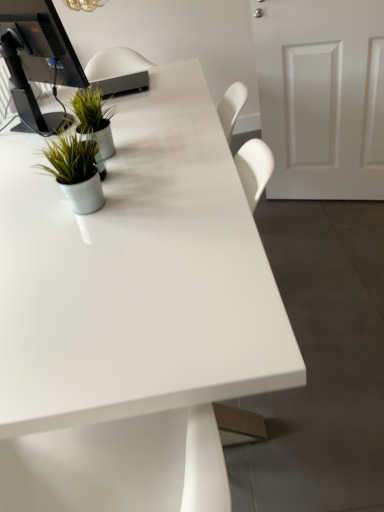
At what (x,y) coordinates should I click in order to perform the action: click on black glossy monitor at upper left. Please return your answer as a coordinate pair (x, y). This screenshot has width=384, height=512. Looking at the image, I should click on (36, 53).

What do you see at coordinates (76, 170) in the screenshot? I see `metallic silver pot at left, which is counted as the first houseplant, starting from the bottom` at bounding box center [76, 170].

Locate an element on the screen. Image resolution: width=384 pixels, height=512 pixels. white matte door at right is located at coordinates (322, 97).

Is point (31, 1) farther from viewer compared to point (53, 164)?

That is True.

Who is smaller, black glossy monitor at upper left or metallic silver pot at left, which is counted as the first houseplant, starting from the bottom?

metallic silver pot at left, which is counted as the first houseplant, starting from the bottom, is smaller.

Can you confirm if black glossy monitor at upper left is shorter than metallic silver pot at left, the 2th houseplant in the top-to-bottom sequence?

In fact, black glossy monitor at upper left may be taller than metallic silver pot at left, the 2th houseplant in the top-to-bottom sequence.

Can you confirm if white glossy desk at center is thinner than metallic silver pot at left, marked as the first houseplant in a front-to-back arrangement?

In fact, white glossy desk at center might be wider than metallic silver pot at left, marked as the first houseplant in a front-to-back arrangement.

Which is more to the right, white glossy desk at center or metallic silver pot at left, the 2th houseplant in the top-to-bottom sequence?

Positioned to the right is white glossy desk at center.

Is white glossy desk at center turned away from metallic silver pot at left, positioned as the 2th houseplant in back-to-front order?

That's not correct — white glossy desk at center is not looking away from metallic silver pot at left, positioned as the 2th houseplant in back-to-front order.

How far apart are white glossy desk at center and metallic silver pot at left, positioned as the 2th houseplant in back-to-front order?

white glossy desk at center is 13.49 inches away from metallic silver pot at left, positioned as the 2th houseplant in back-to-front order.

Is white glossy desk at center positioned beyond the bounds of green matte plant at upper left, which is the 1th houseplant in back-to-front order?

Absolutely, white glossy desk at center is external to green matte plant at upper left, which is the 1th houseplant in back-to-front order.

Would you say white glossy desk at center is a long distance from green matte plant at upper left, marked as the second houseplant in a front-to-back arrangement?

No.

Does white glossy desk at center come in front of green matte plant at upper left, arranged as the 1th houseplant when viewed from the top?

That is True.

From a real-world perspective, between white glossy desk at center and green matte plant at upper left, which is the 2th houseplant in bottom-to-top order, who is vertically higher?

green matte plant at upper left, which is the 2th houseplant in bottom-to-top order.

Can you tell me how much white matte door at right and metallic silver pot at left, which is counted as the first houseplant, starting from the bottom, differ in facing direction?

white matte door at right and metallic silver pot at left, which is counted as the first houseplant, starting from the bottom, are facing 111 degrees away from each other.

Does white matte door at right touch metallic silver pot at left, positioned as the 2th houseplant in back-to-front order?

No, white matte door at right is not touching metallic silver pot at left, positioned as the 2th houseplant in back-to-front order.

In terms of width, does white matte door at right look wider or thinner when compared to metallic silver pot at left, marked as the first houseplant in a front-to-back arrangement?

Considering their sizes, white matte door at right looks slimmer than metallic silver pot at left, marked as the first houseplant in a front-to-back arrangement.

From a real-world perspective, is white matte door at right over metallic silver pot at left, the 2th houseplant in the top-to-bottom sequence?

No, from a real-world perspective, white matte door at right is not above metallic silver pot at left, the 2th houseplant in the top-to-bottom sequence.

From the image's perspective, between green matte plant at upper left, which is the 1th houseplant in back-to-front order, and metallic silver pot at left, marked as the first houseplant in a front-to-back arrangement, which one is located above?

green matte plant at upper left, which is the 1th houseplant in back-to-front order, is shown above in the image.

Which object is further away from the camera, green matte plant at upper left, which is the 1th houseplant in back-to-front order, or metallic silver pot at left, marked as the first houseplant in a front-to-back arrangement?

green matte plant at upper left, which is the 1th houseplant in back-to-front order, is further from the camera.

From a real-world perspective, between green matte plant at upper left, marked as the second houseplant in a front-to-back arrangement, and metallic silver pot at left, positioned as the 2th houseplant in back-to-front order, who is vertically higher?

metallic silver pot at left, positioned as the 2th houseplant in back-to-front order, is physically above.

Which object is positioned more to the right, white glossy desk at center or white matte door at right?

Positioned to the right is white matte door at right.

Which is correct: white glossy desk at center is inside white matte door at right, or outside of it?

white glossy desk at center cannot be found inside white matte door at right.

Which of these two, white glossy desk at center or white matte door at right, stands taller?

With more height is white matte door at right.

Is point (54, 150) closer or farther from the camera than point (365, 71)?

Point (54, 150) is closer to the camera than point (365, 71).

Is metallic silver pot at left, positioned as the 2th houseplant in back-to-front order, far from white matte door at right?

metallic silver pot at left, positioned as the 2th houseplant in back-to-front order, is positioned a significant distance from white matte door at right.

From a real-world perspective, is metallic silver pot at left, the 2th houseplant in the top-to-bottom sequence, below white matte door at right?

Actually, metallic silver pot at left, the 2th houseplant in the top-to-bottom sequence, is physically above white matte door at right in the real world.

Is metallic silver pot at left, marked as the first houseplant in a front-to-back arrangement, inside the boundaries of white matte door at right, or outside?

metallic silver pot at left, marked as the first houseplant in a front-to-back arrangement, is spatially situated outside white matte door at right.

Where is `desktop computer lying above the metallic silver pot at left, positioned as the 2th houseplant in back-to-front order (from the image's perspective)`? This screenshot has width=384, height=512. desktop computer lying above the metallic silver pot at left, positioned as the 2th houseplant in back-to-front order (from the image's perspective) is located at coordinates (36, 53).

In the image, there is a metallic silver pot at left, which is counted as the first houseplant, starting from the bottom. Where is `desk below it (from the image's perspective)`? The height and width of the screenshot is (512, 384). desk below it (from the image's perspective) is located at coordinates (133, 314).

Considering their positions, is green matte plant at upper left, which is the 1th houseplant in back-to-front order, positioned closer to white matte door at right than metallic silver pot at left, marked as the first houseplant in a front-to-back arrangement?

The object closer to white matte door at right is green matte plant at upper left, which is the 1th houseplant in back-to-front order.

Which object lies further to the anchor point white matte door at right, metallic silver pot at left, positioned as the 2th houseplant in back-to-front order, or white glossy desk at center?

The object further to white matte door at right is metallic silver pot at left, positioned as the 2th houseplant in back-to-front order.

From the image, which object appears to be nearer to white matte door at right, white glossy desk at center or black glossy monitor at upper left?

Among the two, white glossy desk at center is located nearer to white matte door at right.

From the image, which object appears to be nearer to green matte plant at upper left, which is the 1th houseplant in back-to-front order, white glossy desk at center or black glossy monitor at upper left?

white glossy desk at center.

Which object lies nearer to the anchor point black glossy monitor at upper left, white glossy desk at center or metallic silver pot at left, marked as the first houseplant in a front-to-back arrangement?

white glossy desk at center lies closer to black glossy monitor at upper left than the other object.

Estimate the real-world distances between objects in this image. Which object is further from green matte plant at upper left, marked as the second houseplant in a front-to-back arrangement, white glossy desk at center or white matte door at right?

The object further to green matte plant at upper left, marked as the second houseplant in a front-to-back arrangement, is white matte door at right.

Looking at the image, which one is located closer to black glossy monitor at upper left, white glossy desk at center or white matte door at right?

white glossy desk at center lies closer to black glossy monitor at upper left than the other object.

Considering their positions, is white glossy desk at center positioned closer to metallic silver pot at left, marked as the first houseplant in a front-to-back arrangement, than black glossy monitor at upper left?

A: white glossy desk at center is closer to metallic silver pot at left, marked as the first houseplant in a front-to-back arrangement.

Identify the location of houseplant between black glossy monitor at upper left and metallic silver pot at left, the 2th houseplant in the top-to-bottom sequence, vertically. (94, 119).

Locate an element on the screen. This screenshot has width=384, height=512. desk between green matte plant at upper left, which is the 1th houseplant in back-to-front order, and white matte door at right from left to right is located at coordinates click(133, 314).

Identify the location of houseplant between green matte plant at upper left, arranged as the 1th houseplant when viewed from the top, and white matte door at right, in the horizontal direction. (76, 170).

Identify the location of desk between metallic silver pot at left, marked as the first houseplant in a front-to-back arrangement, and white matte door at right, in the horizontal direction. (133, 314).